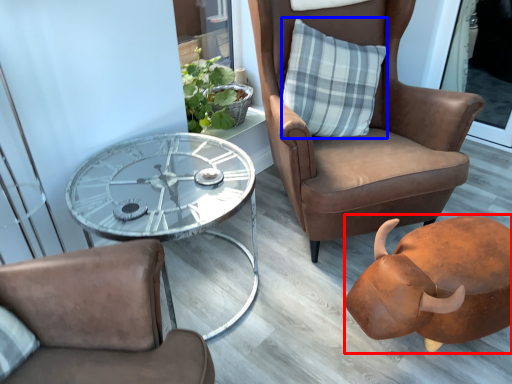
Question: Which point is closer to the camera, piggy bank (highlighted by a red box) or pillow (highlighted by a blue box)?

Choices:
 (A) piggy bank
 (B) pillow

Answer: (A)